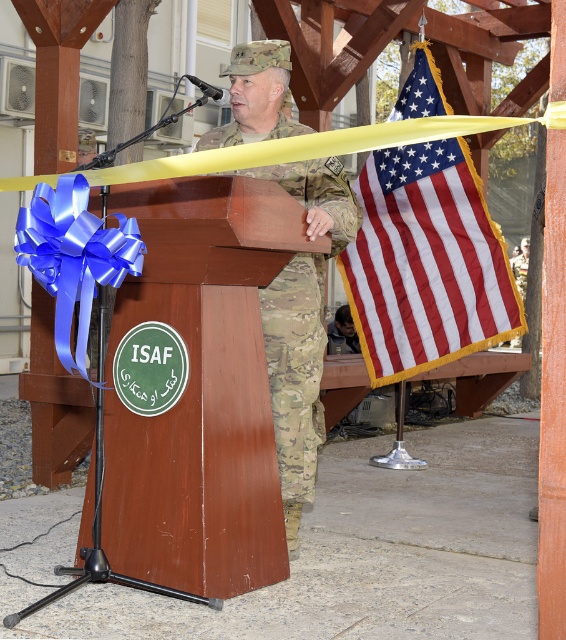
You are a photographer positioned at the back of the pavilion. You want to take a photo of the brown wood podium at center and the blue satin ribbon at left. Which object should you focus on first to ensure it appears larger in the photo?

The brown wood podium at center is closer to you than the blue satin ribbon at left, so focusing on it first will make it appear larger in the photo.

You are a photographer at the military ceremony and need to position yourself to capture the brown wood podium at center in your shot. The camera you are using has a focal length of 50mm. Given that the podium is located at coordinates point 0.611, 0.355, can you determine if the podium will be centered in your frame?

The brown wood podium at center is located at point (x=200, y=390). Since the coordinates are not exactly at the center point of the frame, the podium will not be perfectly centered in the shot.